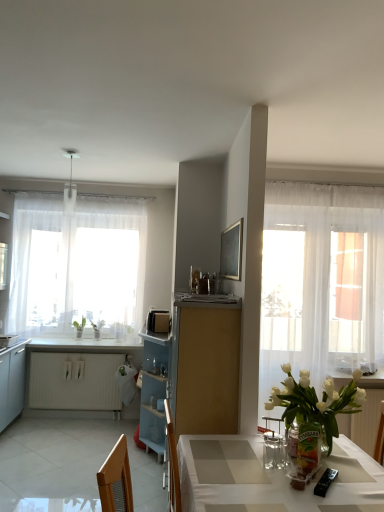
At what (x,y) coordinates should I click in order to perform the action: click on free space on the front side of black plastic remote control at lower right, the 3th appliance in the top-to-bottom sequence. Please return your answer as a coordinate pair (x, y). Looking at the image, I should click on (338, 499).